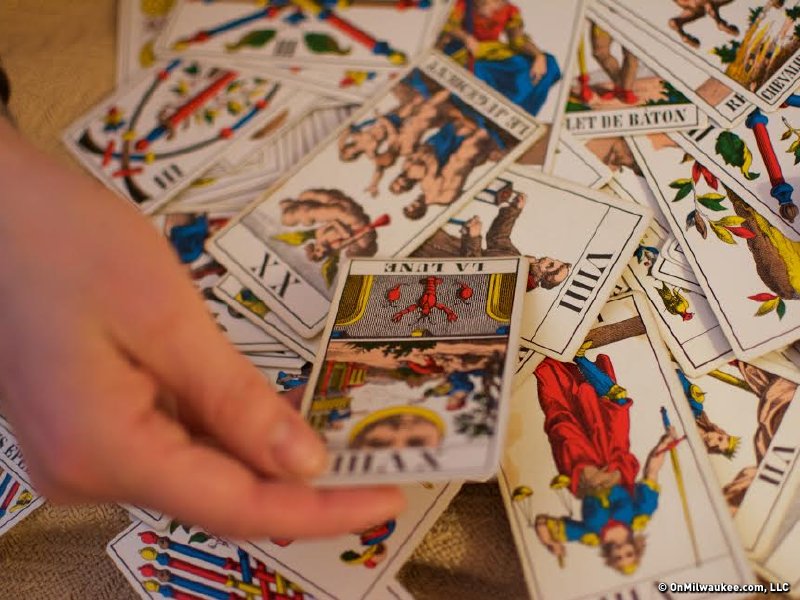
The height and width of the screenshot is (600, 800). Identify the location of lantern. (500, 194).